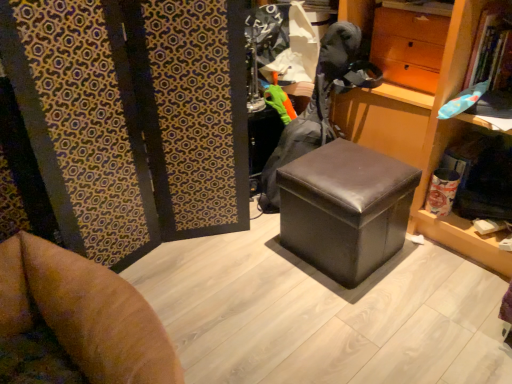
Where is `green fabric glove at center`? green fabric glove at center is located at coordinates (319, 104).

Measure the distance between wooden bookshelf at center and camera.

4.61 feet.

What do you see at coordinates (345, 209) in the screenshot? Image resolution: width=512 pixels, height=384 pixels. I see `black leather ottoman at center` at bounding box center [345, 209].

Measure the distance between point (352,212) and camera.

Point (352,212) is 1.46 meters from camera.

Find the location of a particular element. Image resolution: width=512 pixels, height=384 pixels. green fabric glove at center is located at coordinates (319, 104).

Who is shorter, green fabric glove at center or black leather ottoman at center?

black leather ottoman at center.

Which is more to the right, green fabric glove at center or black leather ottoman at center?

black leather ottoman at center.

Which object is further away from the camera taking this photo, green fabric glove at center or black leather ottoman at center?

green fabric glove at center is further from the camera.

Locate an element on the screen. This screenshot has height=384, width=512. stool on the right of green fabric glove at center is located at coordinates (345, 209).

Between matte brown drawer at upper right and green fabric glove at center, which one is positioned behind?

matte brown drawer at upper right is behind.

From a real-world perspective, is matte brown drawer at upper right located higher than green fabric glove at center?

Yes.

What's the angular difference between matte brown drawer at upper right and green fabric glove at center's facing directions?

The angular difference between matte brown drawer at upper right and green fabric glove at center is 90 degrees.

Which is behind, black leather ottoman at center or wooden bookshelf at center?

black leather ottoman at center is further from the camera.

Is wooden bookshelf at center at the back of black leather ottoman at center?

black leather ottoman at center does not have its back to wooden bookshelf at center.

Considering the sizes of objects black leather ottoman at center and wooden bookshelf at center in the image provided, who is taller, black leather ottoman at center or wooden bookshelf at center?

Standing taller between the two is wooden bookshelf at center.

How different are the orientations of black leather ottoman at center and wooden bookshelf at center in degrees?

There is a 90-degree angle between the facing directions of black leather ottoman at center and wooden bookshelf at center.

Measure the distance from black leather ottoman at center to green fabric glove at center.

black leather ottoman at center and green fabric glove at center are 13.46 inches apart from each other.

Between black leather ottoman at center and green fabric glove at center, which one has more height?

green fabric glove at center.

Find the location of a particular element. The image size is (512, 384). clothing to the left of black leather ottoman at center is located at coordinates (319, 104).

Between black leather ottoman at center and green fabric glove at center, which one is positioned in front?

black leather ottoman at center is more forward.

Considering the sizes of matte brown drawer at upper right and wooden bookshelf at center in the image, is matte brown drawer at upper right taller or shorter than wooden bookshelf at center?

In the image, matte brown drawer at upper right appears to be shorter than wooden bookshelf at center.

Is matte brown drawer at upper right further to the viewer compared to wooden bookshelf at center?

Yes, it is behind wooden bookshelf at center.

From the image's perspective, is matte brown drawer at upper right above or below wooden bookshelf at center?

matte brown drawer at upper right is above wooden bookshelf at center.

Is point (339, 0) positioned after point (337, 67)?

That is True.

Is wooden bookshelf at center inside or outside of green fabric glove at center?

wooden bookshelf at center is not enclosed by green fabric glove at center.

Is wooden bookshelf at center shorter than green fabric glove at center?

No.

Is wooden bookshelf at center positioned before green fabric glove at center?

Yes.

From the image's perspective, which one is positioned higher, wooden bookshelf at center or matte brown drawer at upper right?

matte brown drawer at upper right is shown above in the image.

Looking at this image, between wooden bookshelf at center and matte brown drawer at upper right, which one is positioned behind?

matte brown drawer at upper right is further away from the camera.

Does wooden bookshelf at center appear on the right side of matte brown drawer at upper right?

In fact, wooden bookshelf at center is to the left of matte brown drawer at upper right.

Measure the distance from wooden bookshelf at center to matte brown drawer at upper right.

They are 6.45 inches apart.

I want to click on clothing above the black leather ottoman at center (from a real-world perspective), so click(x=319, y=104).

Where is `clothing directly beneath the matte brown drawer at upper right (from a real-world perspective)`? clothing directly beneath the matte brown drawer at upper right (from a real-world perspective) is located at coordinates (319, 104).

Looking at the image, which one is located further to matte brown drawer at upper right, wooden bookshelf at center or black leather ottoman at center?

black leather ottoman at center is positioned further to the anchor matte brown drawer at upper right.

Estimate the real-world distances between objects in this image. Which object is closer to matte brown drawer at upper right, green fabric glove at center or wooden bookshelf at center?

The object closer to matte brown drawer at upper right is wooden bookshelf at center.

Estimate the real-world distances between objects in this image. Which object is further from wooden bookshelf at center, green fabric glove at center or matte brown drawer at upper right?

Based on the image, green fabric glove at center appears to be further to wooden bookshelf at center.

Which object lies nearer to the anchor point black leather ottoman at center, wooden bookshelf at center or green fabric glove at center?

The object closer to black leather ottoman at center is wooden bookshelf at center.

Considering their positions, is black leather ottoman at center positioned closer to green fabric glove at center than matte brown drawer at upper right?

Among the two, matte brown drawer at upper right is located nearer to green fabric glove at center.

Considering their positions, is green fabric glove at center positioned closer to black leather ottoman at center than matte brown drawer at upper right?

green fabric glove at center is closer to black leather ottoman at center.

Looking at the image, which one is located further to black leather ottoman at center, matte brown drawer at upper right or wooden bookshelf at center?

matte brown drawer at upper right is positioned further to the anchor black leather ottoman at center.

Which object lies further to the anchor point green fabric glove at center, matte brown drawer at upper right or wooden bookshelf at center?

wooden bookshelf at center is further to green fabric glove at center.

This screenshot has width=512, height=384. Identify the location of bookshelf that lies between matte brown drawer at upper right and black leather ottoman at center from top to bottom. (425, 135).

Identify the location of clothing between wooden bookshelf at center and black leather ottoman at center in the up-down direction. This screenshot has height=384, width=512. point(319,104).

Locate an element on the screen. clothing between matte brown drawer at upper right and black leather ottoman at center vertically is located at coordinates (319, 104).

This screenshot has height=384, width=512. What are the coordinates of `clothing between wooden bookshelf at center and matte brown drawer at upper right from front to back` in the screenshot? It's located at (319, 104).